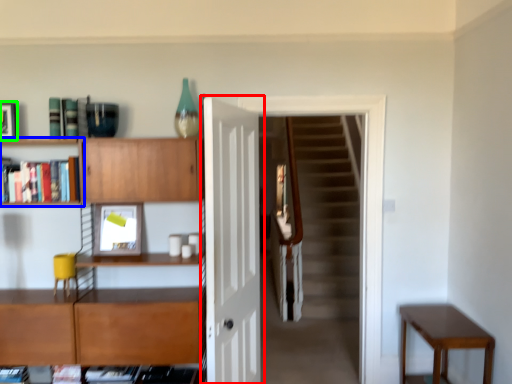
Question: Which is farther away from door (highlighted by a red box)? shelf (highlighted by a blue box) or picture frame (highlighted by a green box)?

Choices:
 (A) shelf
 (B) picture frame

Answer: (B)